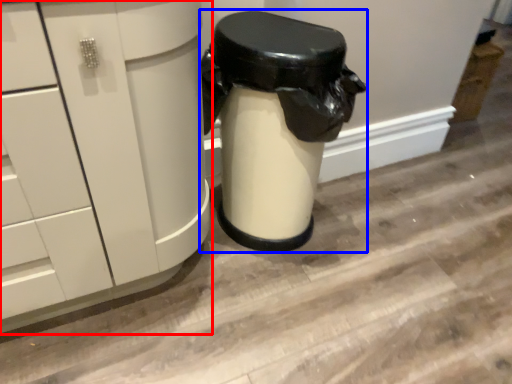
Question: Which object appears closest to the camera in this image, cabinetry (highlighted by a red box) or garbage (highlighted by a blue box)?

Choices:
 (A) cabinetry
 (B) garbage

Answer: (A)